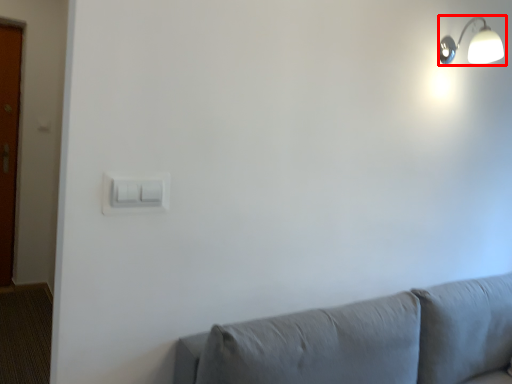
Question: From the image's perspective, where is lamp (annotated by the red box) located relative to light switch?

Choices:
 (A) below
 (B) above

Answer: (B)